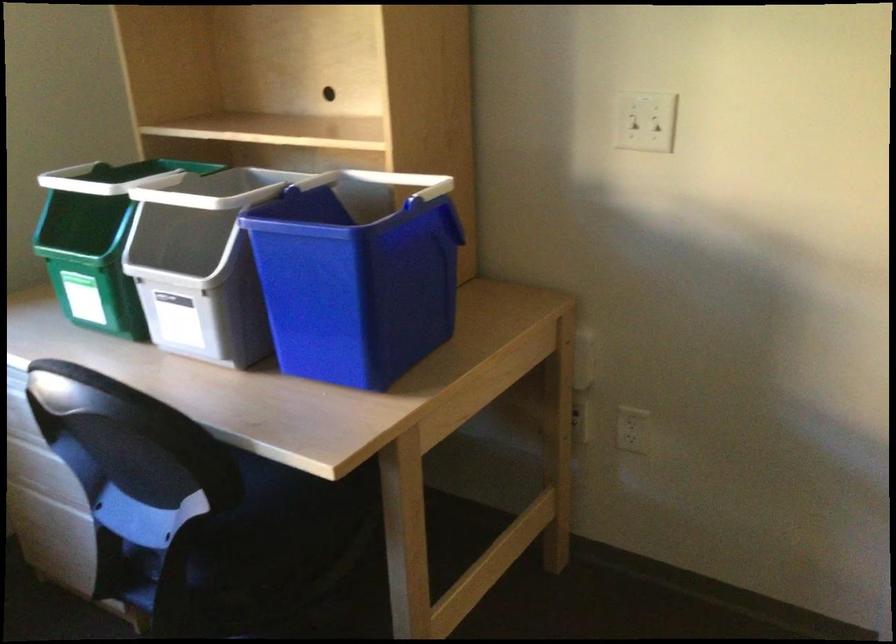
Identify the location of light switch toggle. This screenshot has width=896, height=644. (643, 118).